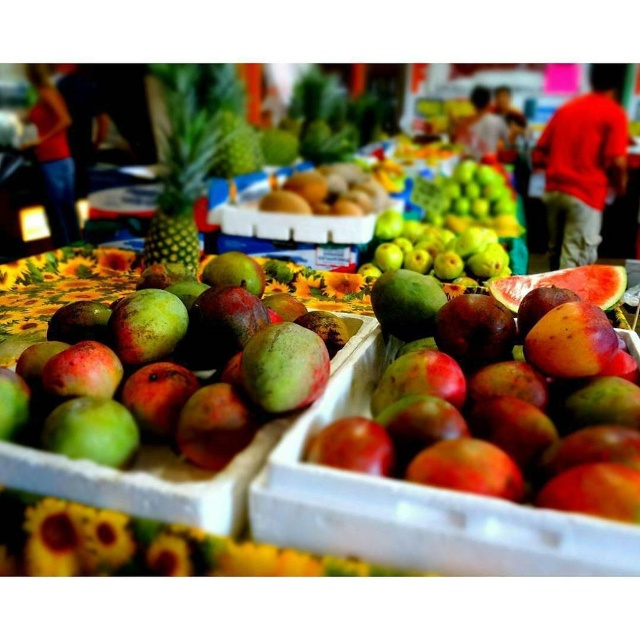
You are a customer at the fruit market and want to pick a mango that is not covered by another mango. Which mango between the ripe mango at center and the green matte mango at center should you choose?

The green matte mango at center is not covered because the ripe mango at center is positioned under it.

You are a customer at the fruit market and want to buy a mango. You see a ripe mango at center and a green matte mango at center. Which one is more to the right?

The ripe mango at center is positioned on the right side of green matte mango at center, so it is more to the right.